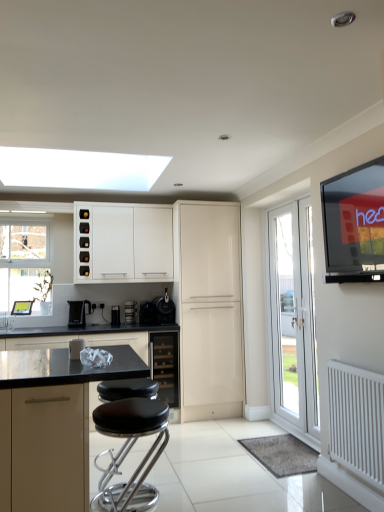
Question: Is black plastic coffee machine at lower left wider than white glossy door at right?

Choices:
 (A) no
 (B) yes

Answer: (B)

Question: Does black plastic coffee machine at lower left appear on the right side of white glossy door at right?

Choices:
 (A) no
 (B) yes

Answer: (A)

Question: From the image's perspective, is black plastic coffee machine at lower left above white glossy door at right?

Choices:
 (A) yes
 (B) no

Answer: (B)

Question: Does black plastic coffee machine at lower left have a greater height compared to white glossy door at right?

Choices:
 (A) yes
 (B) no

Answer: (B)

Question: Can you confirm if black plastic coffee machine at lower left is bigger than white glossy door at right?

Choices:
 (A) no
 (B) yes

Answer: (A)

Question: From a real-world perspective, relative to white matte cabinet at upper left, the first cabinetry in the back-to-front sequence, is black plastic toaster at center, which is counted as the second appliance, starting from the left, vertically above or below?

Choices:
 (A) above
 (B) below

Answer: (B)

Question: Considering the positions of point (125, 314) and point (82, 267), is point (125, 314) closer or farther from the camera than point (82, 267)?

Choices:
 (A) closer
 (B) farther

Answer: (B)

Question: Considering the positions of black plastic toaster at center, which is counted as the second appliance, starting from the left, and white matte cabinet at upper left, which is the fifth cabinetry in front-to-back order, in the image, is black plastic toaster at center, which is counted as the second appliance, starting from the left, taller or shorter than white matte cabinet at upper left, which is the fifth cabinetry in front-to-back order,?

Choices:
 (A) tall
 (B) short

Answer: (B)

Question: Considering the positions of black plastic toaster at center, which ranks as the 3th appliance in right-to-left order, and white matte cabinet at upper left, the first cabinetry in the back-to-front sequence, in the image, is black plastic toaster at center, which ranks as the 3th appliance in right-to-left order, wider or thinner than white matte cabinet at upper left, the first cabinetry in the back-to-front sequence,?

Choices:
 (A) thin
 (B) wide

Answer: (A)

Question: Is black plastic toaster at center, the fourth appliance positioned from the right, to the left or to the right of flat-screen tv at upper right in the image?

Choices:
 (A) right
 (B) left

Answer: (B)

Question: Considering the positions of black plastic toaster at center, the fourth appliance positioned from the right, and flat-screen tv at upper right in the image, is black plastic toaster at center, the fourth appliance positioned from the right, taller or shorter than flat-screen tv at upper right?

Choices:
 (A) short
 (B) tall

Answer: (A)

Question: Is point (117, 317) closer or farther from the camera than point (337, 225)?

Choices:
 (A) farther
 (B) closer

Answer: (A)

Question: Considering the positions of black plastic toaster at center, the fourth appliance positioned from the right, and flat-screen tv at upper right in the image, is black plastic toaster at center, the fourth appliance positioned from the right, bigger or smaller than flat-screen tv at upper right?

Choices:
 (A) small
 (B) big

Answer: (A)

Question: From a real-world perspective, is flat-screen tv at upper right above or below glossy cream cabinet at center, placed as the 4th cabinetry when sorted from front to back?

Choices:
 (A) below
 (B) above

Answer: (B)

Question: From their relative heights in the image, would you say flat-screen tv at upper right is taller or shorter than glossy cream cabinet at center, which is counted as the 2th cabinetry, starting from the back?

Choices:
 (A) short
 (B) tall

Answer: (A)